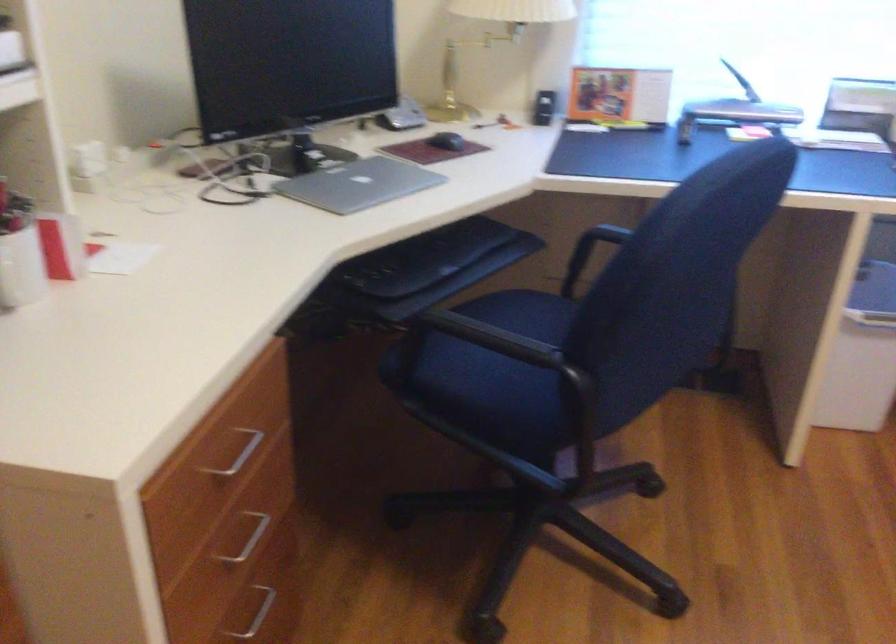
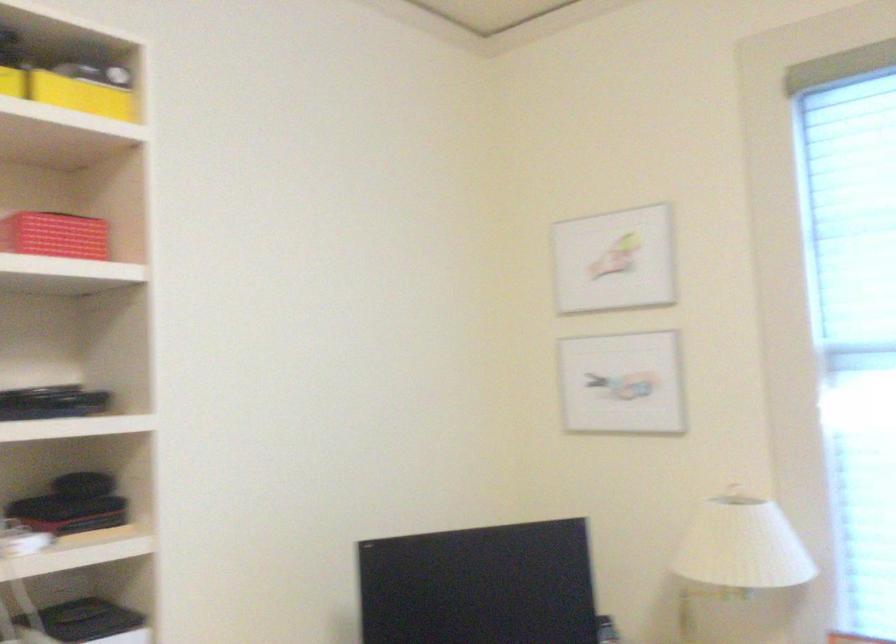
The images are taken continuously from a first-person perspective. In which direction is your viewpoint rotating?

The camera's rotation is toward left-up.